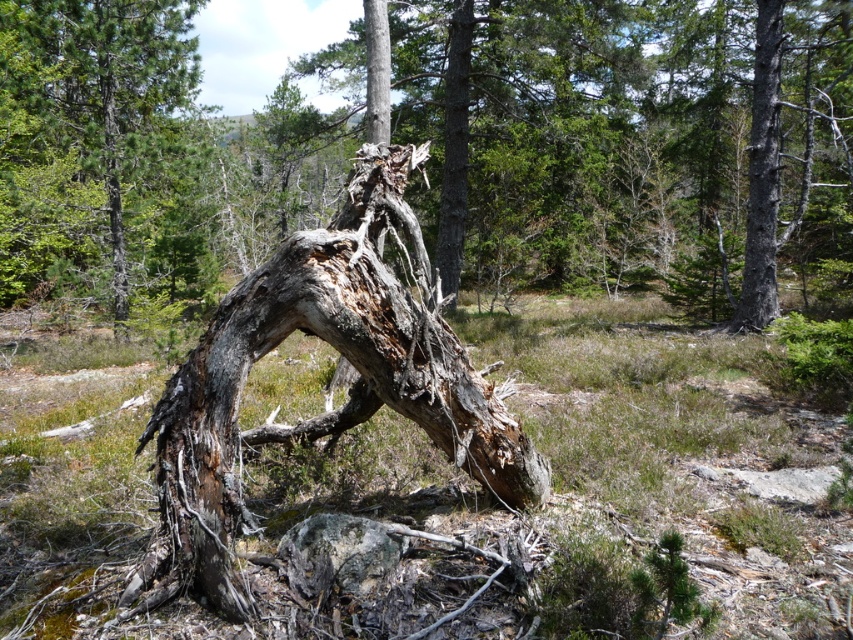
Is grayish-brown bark at center bigger than smooth gray bark at upper right?

Yes, grayish-brown bark at center is bigger than smooth gray bark at upper right.

Measure the distance between point (235, 408) and camera.

Point (235, 408) is 9.06 feet from camera.

Locate an element on the screen. This screenshot has height=640, width=853. grayish-brown bark at center is located at coordinates (345, 356).

Which of these two, gray bark tree at center or smooth gray bark at upper right, stands shorter?

gray bark tree at center is shorter.

Consider the image. Does gray bark tree at center have a greater width compared to smooth gray bark at upper right?

Indeed, gray bark tree at center has a greater width compared to smooth gray bark at upper right.

I want to click on gray bark tree at center, so click(86, 134).

Is grayish-brown bark at center smaller than gray bark tree at center?

Incorrect, grayish-brown bark at center is not smaller in size than gray bark tree at center.

Based on the photo, does grayish-brown bark at center have a greater width compared to gray bark tree at center?

Correct, the width of grayish-brown bark at center exceeds that of gray bark tree at center.

Between point (221, 518) and point (143, 157), which one is positioned in front?

Point (221, 518) is more forward.

Find the location of a particular element. grayish-brown bark at center is located at coordinates (345, 356).